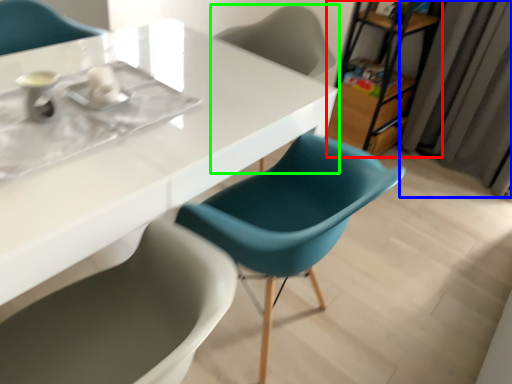
Question: Estimate the real-world distances between objects in this image. Which object is closer to bookshelf (highlighted by a red box), curtain (highlighted by a blue box) or chair (highlighted by a green box)?

Choices:
 (A) curtain
 (B) chair

Answer: (A)